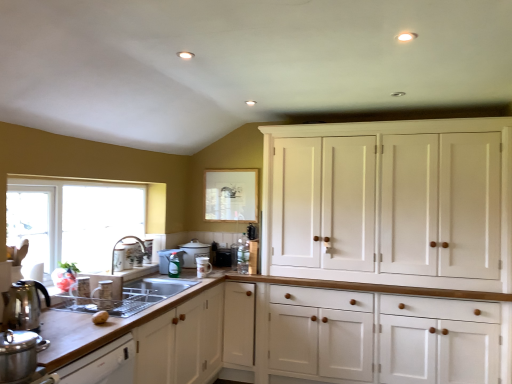
The height and width of the screenshot is (384, 512). I want to click on free space in front of shiny metallic kettle at left, so click(25, 339).